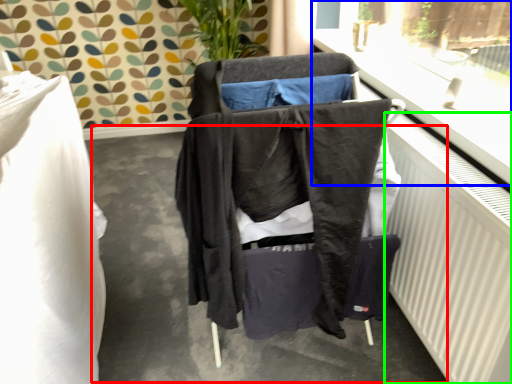
Question: Which object is the farthest from concrete (highlighted by a red box)? Choose among these: window frame (highlighted by a blue box) or radiator (highlighted by a green box).

Choices:
 (A) window frame
 (B) radiator

Answer: (A)